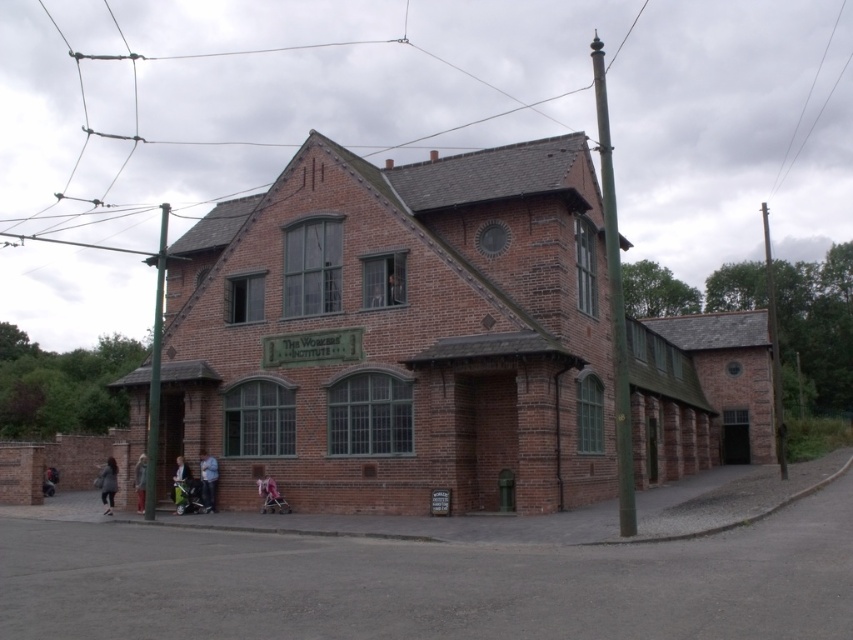
Question: Does metallic wire at upper right appear on the left side of dark gray coat at lower left?

Choices:
 (A) no
 (B) yes

Answer: (A)

Question: Can you confirm if green painted wood pole at right is smaller than denim jacket at lower left?

Choices:
 (A) yes
 (B) no

Answer: (B)

Question: Which object is farther from the camera taking this photo?

Choices:
 (A) brown wooden pole at right
 (B) light pink fabric stroller at lower center
 (C) denim jacket at lower left

Answer: (A)

Question: Which of the following is the closest to the observer?

Choices:
 (A) (172, 477)
 (B) (212, 476)
 (C) (141, 493)
 (D) (840, 4)

Answer: (B)

Question: Which of the following is the closest to the observer?

Choices:
 (A) (105, 488)
 (B) (596, 56)

Answer: (A)

Question: Can you confirm if light pink fabric stroller at lower center is wider than light brown leather jacket at lower center?

Choices:
 (A) no
 (B) yes

Answer: (B)